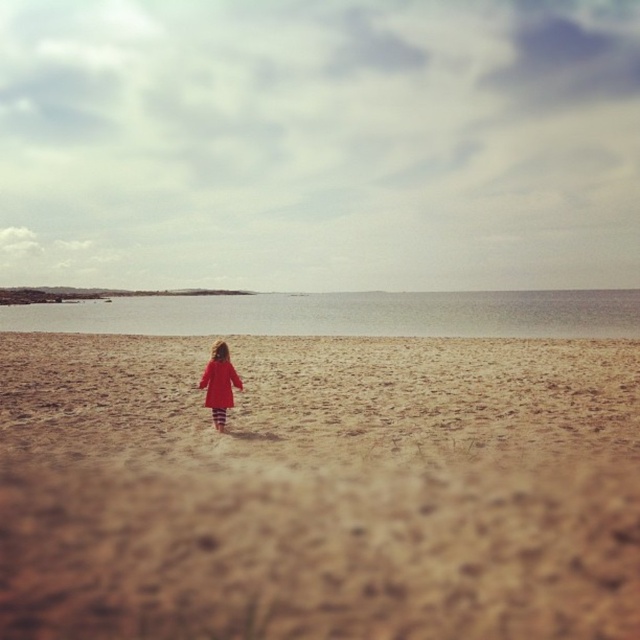
In the scene shown: Can you confirm if clear water at center is positioned above matte red coat at center?

Indeed, clear water at center is positioned over matte red coat at center.

Between point (348, 296) and point (228, 371), which one is positioned in front?

Point (228, 371) is more forward.

Where is `clear water at center`? This screenshot has height=640, width=640. clear water at center is located at coordinates (346, 314).

Measure the distance between point (337, 468) and camera.

The distance of point (337, 468) from camera is 11.14 meters.

Between brown sandy beach at center and matte red coat at center, which one is positioned higher?

matte red coat at center

Does point (244, 532) come in front of point (221, 352)?

That is True.

At what (x,y) coordinates should I click in order to perform the action: click on brown sandy beach at center. Please return your answer as a coordinate pair (x, y). This screenshot has height=640, width=640. Looking at the image, I should click on (320, 490).

Between brown sandy beach at center and clear water at center, which one appears on the right side from the viewer's perspective?

From the viewer's perspective, brown sandy beach at center appears more on the right side.

Who is positioned more to the left, brown sandy beach at center or clear water at center?

Positioned to the left is clear water at center.

Is point (13, 509) more distant than point (76, 321)?

No, it is not.

Locate an element on the screen. Image resolution: width=640 pixels, height=640 pixels. brown sandy beach at center is located at coordinates (320, 490).